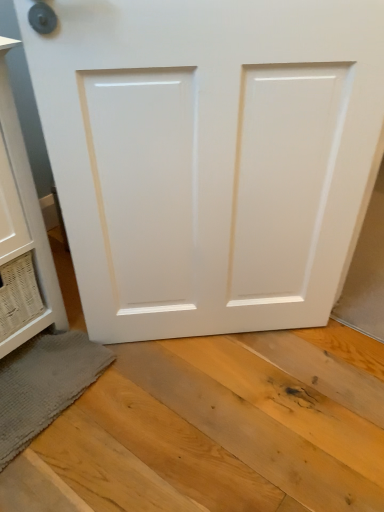
What is the approximate width of white glossy cabinet at left?

white glossy cabinet at left is 21.28 inches wide.

At what (x,y) coordinates should I click in order to perform the action: click on white glossy cabinet at left. Please return your answer as a coordinate pair (x, y). Looking at the image, I should click on (23, 215).

Can you tell me how much white glossy cabinet at left and gray textured bath mat at lower left differ in facing direction?

The angular difference between white glossy cabinet at left and gray textured bath mat at lower left is 3.66 degrees.

From the image's perspective, which is above, white glossy cabinet at left or gray textured bath mat at lower left?

white glossy cabinet at left.

Does white glossy cabinet at left have a greater height compared to gray textured bath mat at lower left?

Correct, white glossy cabinet at left is much taller as gray textured bath mat at lower left.

Is white glossy cabinet at left facing towards white glossy door at center?

No, white glossy cabinet at left is not oriented towards white glossy door at center.

Locate an element on the screen. The height and width of the screenshot is (512, 384). cabinetry located above the white glossy door at center (from the image's perspective) is located at coordinates (23, 215).

From the image's perspective, would you say white glossy cabinet at left is shown under white glossy door at center?

No.

Based on the photo, does white glossy cabinet at left lie in front of white glossy door at center?

Yes, it is in front of white glossy door at center.

Is gray textured bath mat at lower left positioned with its back to white glossy cabinet at left?

Absolutely, gray textured bath mat at lower left is directed away from white glossy cabinet at left.

Choose the correct answer: Is gray textured bath mat at lower left inside white glossy cabinet at left or outside it?

gray textured bath mat at lower left is not inside white glossy cabinet at left, it's outside.

Considering the relative sizes of gray textured bath mat at lower left and white glossy cabinet at left in the image provided, is gray textured bath mat at lower left bigger than white glossy cabinet at left?

No.

Considering the relative positions of gray textured bath mat at lower left and white glossy cabinet at left in the image provided, is gray textured bath mat at lower left to the left or to the right of white glossy cabinet at left?

gray textured bath mat at lower left is positioned on white glossy cabinet at left's right side.

Is the surface of white glossy door at center in direct contact with white glossy cabinet at left?

No, white glossy door at center is not in contact with white glossy cabinet at left.

Does white glossy door at center come behind white glossy cabinet at left?

Yes, it is behind white glossy cabinet at left.

Does white glossy door at center have a lesser width compared to white glossy cabinet at left?

Yes, white glossy door at center is thinner than white glossy cabinet at left.

From the image's perspective, is white glossy door at center positioned above or below white glossy cabinet at left?

Clearly, from the image's perspective, white glossy door at center is below white glossy cabinet at left.

From a real-world perspective, which is physically above, gray textured bath mat at lower left or white glossy door at center?

white glossy door at center.

Considering the relative sizes of gray textured bath mat at lower left and white glossy door at center in the image provided, is gray textured bath mat at lower left smaller than white glossy door at center?

Yes.

Considering the relative positions of gray textured bath mat at lower left and white glossy door at center in the image provided, is gray textured bath mat at lower left to the left or to the right of white glossy door at center?

gray textured bath mat at lower left is to the left of white glossy door at center.

Is gray textured bath mat at lower left positioned far away from white glossy door at center?

No, gray textured bath mat at lower left is not far away from white glossy door at center.

Is white glossy door at center positioned with its back to gray textured bath mat at lower left?

No, white glossy door at center is not facing away from gray textured bath mat at lower left.

From a real-world perspective, is white glossy door at center on top of gray textured bath mat at lower left?

Yes, from a real-world perspective, white glossy door at center is over gray textured bath mat at lower left

Does point (341, 150) appear closer or farther from the camera than point (66, 392)?

Point (341, 150).

From the image's perspective, is white glossy door at center over gray textured bath mat at lower left?

Yes, from the image's perspective, white glossy door at center is above gray textured bath mat at lower left.

Identify the location of bath mat on the right side of white glossy cabinet at left. (44, 384).

Locate an element on the screen. The height and width of the screenshot is (512, 384). door that appears behind the white glossy cabinet at left is located at coordinates (209, 156).

Based on their spatial positions, is white glossy cabinet at left or white glossy door at center closer to gray textured bath mat at lower left?

Among the two, white glossy cabinet at left is located nearer to gray textured bath mat at lower left.

Based on their spatial positions, is gray textured bath mat at lower left or white glossy cabinet at left closer to white glossy door at center?

Among the two, white glossy cabinet at left is located nearer to white glossy door at center.

Looking at the image, which one is located closer to white glossy door at center, white glossy cabinet at left or gray textured bath mat at lower left?

Among the two, white glossy cabinet at left is located nearer to white glossy door at center.

When comparing their distances from white glossy cabinet at left, does gray textured bath mat at lower left or white glossy door at center seem further?

Among the two, white glossy door at center is located further to white glossy cabinet at left.

Based on their spatial positions, is white glossy door at center or white glossy cabinet at left further from gray textured bath mat at lower left?

The object further to gray textured bath mat at lower left is white glossy door at center.

Looking at the image, which one is located closer to white glossy cabinet at left, white glossy door at center or gray textured bath mat at lower left?

gray textured bath mat at lower left is closer to white glossy cabinet at left.

At what (x,y) coordinates should I click in order to perform the action: click on bath mat between white glossy cabinet at left and white glossy door at center in the horizontal direction. Please return your answer as a coordinate pair (x, y). The width and height of the screenshot is (384, 512). Looking at the image, I should click on (44, 384).